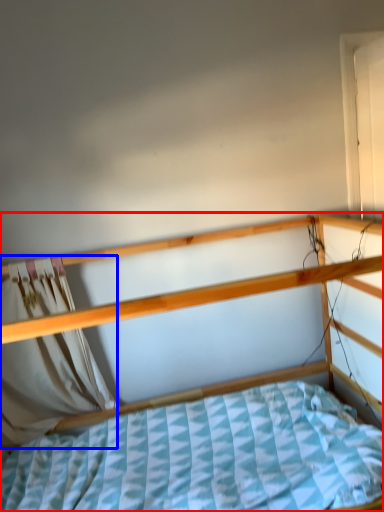
Question: Among these objects, which one is nearest to the camera, bed (highlighted by a red box) or curtain (highlighted by a blue box)?

Choices:
 (A) bed
 (B) curtain

Answer: (A)